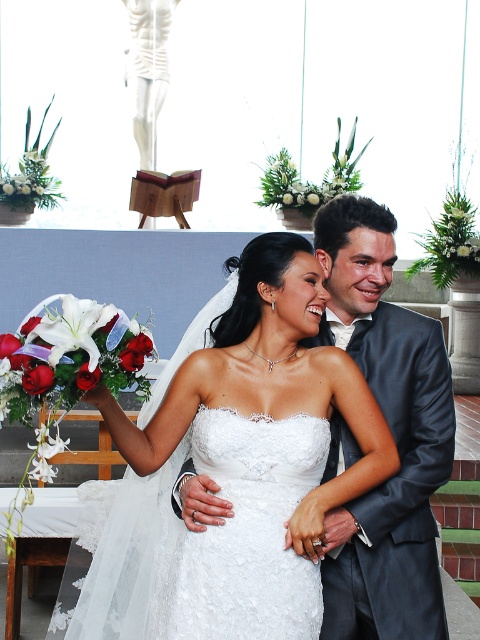
Can you confirm if satin gray suit at right is bigger than white lace wedding dress at center?

Yes.

The height and width of the screenshot is (640, 480). Identify the location of satin gray suit at right. (391, 432).

This screenshot has width=480, height=640. Describe the element at coordinates (391, 432) in the screenshot. I see `satin gray suit at right` at that location.

The height and width of the screenshot is (640, 480). What are the coordinates of `satin gray suit at right` in the screenshot? It's located at (391, 432).

Between point (256, 264) and point (441, 448), which one is positioned in front?

Point (256, 264)

Who is positioned more to the right, white lace dress at center or satin gray suit at right?

satin gray suit at right

Which is behind, point (129, 627) or point (344, 561)?

The point (129, 627) is more distant.

You are a GUI agent. You are given a task and a screenshot of the screen. Output one action in this format:
    pyautogui.click(x=<x>, y=<y>)
    Task: Click on the white lace dress at center
    
    Given the screenshot: What is the action you would take?
    pyautogui.click(x=236, y=467)

Who is positioned more to the left, white lace dress at center or white lace wedding dress at center?

white lace dress at center

The width and height of the screenshot is (480, 640). Describe the element at coordinates (236, 467) in the screenshot. I see `white lace dress at center` at that location.

Where is `white lace dress at center`? This screenshot has width=480, height=640. white lace dress at center is located at coordinates (236, 467).